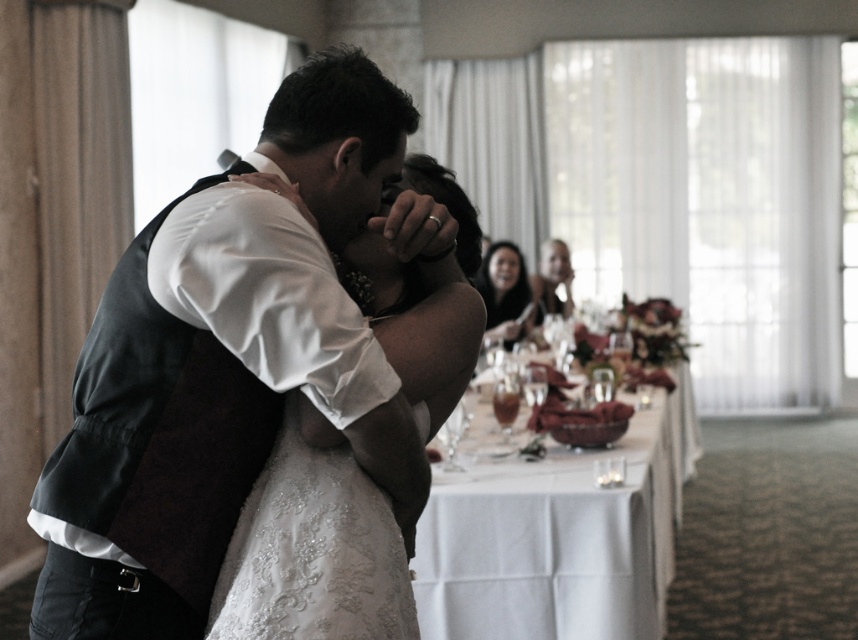
Question: Based on their relative distances, which object is farther from the smooth black hair at center?

Choices:
 (A) matte black vest at center
 (B) white cloth at center

Answer: (A)

Question: Which object is closer to the camera taking this photo?

Choices:
 (A) smooth black hair at center
 (B) matte black vest at center
 (C) white cloth at center

Answer: (B)

Question: Among these objects, which one is nearest to the camera?

Choices:
 (A) matte black vest at center
 (B) smooth black hair at center
 (C) white cloth at center

Answer: (A)

Question: Does matte black vest at center appear on the right side of white cloth at center?

Choices:
 (A) no
 (B) yes

Answer: (A)

Question: Does matte black vest at center have a smaller size compared to smooth black hair at center?

Choices:
 (A) no
 (B) yes

Answer: (A)

Question: Is matte black vest at center to the right of white cloth at center from the viewer's perspective?

Choices:
 (A) no
 (B) yes

Answer: (A)